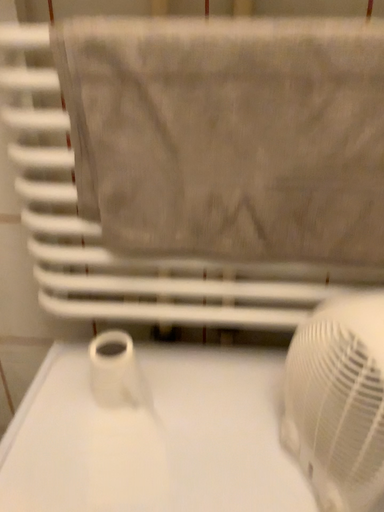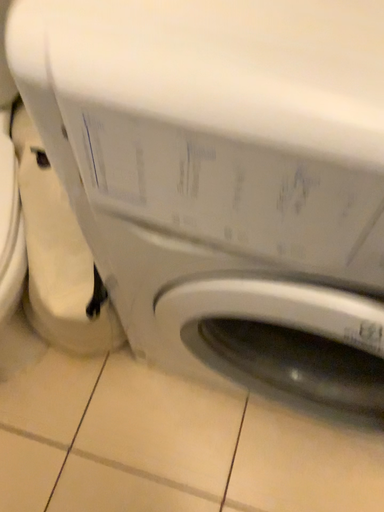
Question: Which way did the camera rotate in the video?

Choices:
 (A) rotated left
 (B) rotated right

Answer: (A)